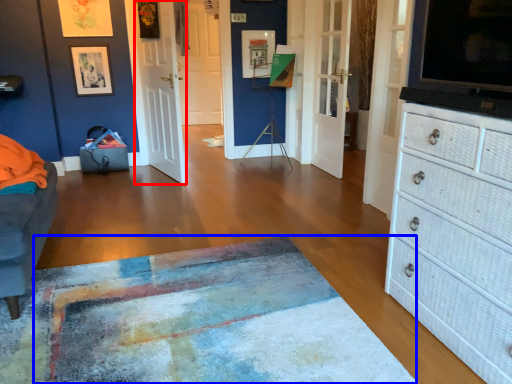
Question: Which object is further to the camera taking this photo, door (highlighted by a red box) or mat (highlighted by a blue box)?

Choices:
 (A) door
 (B) mat

Answer: (A)